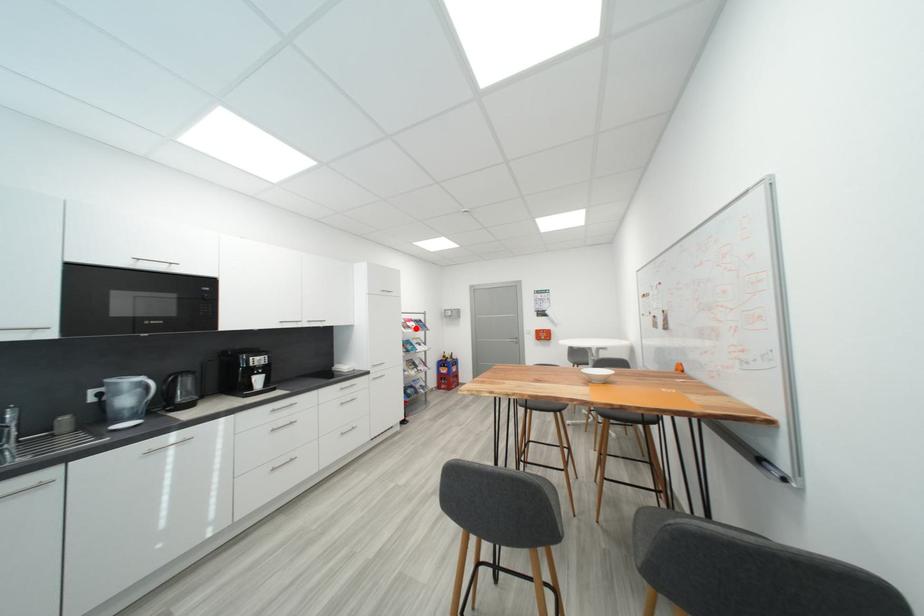
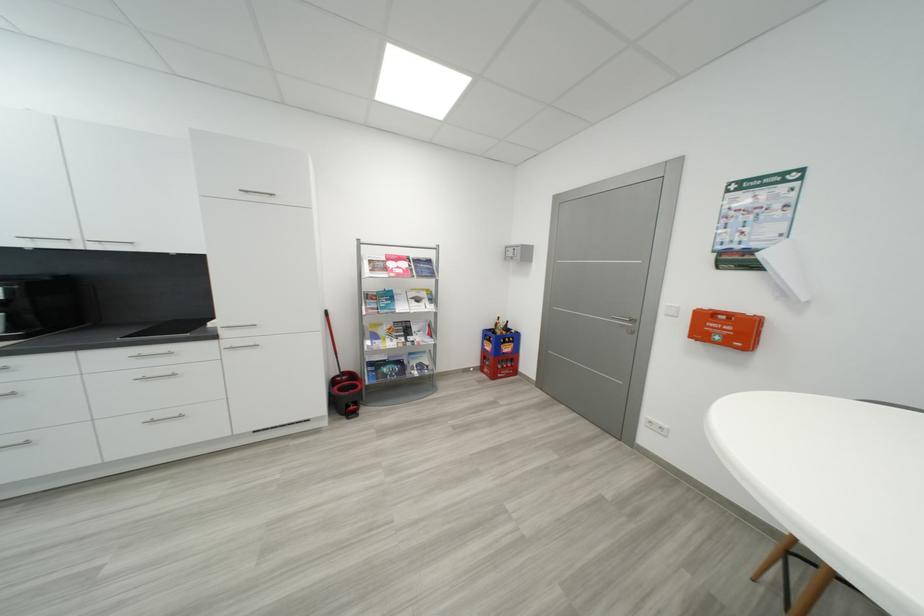
The point at the highlighted location is marked in the first image. Where is the corresponding point in the second image?

(393, 270)